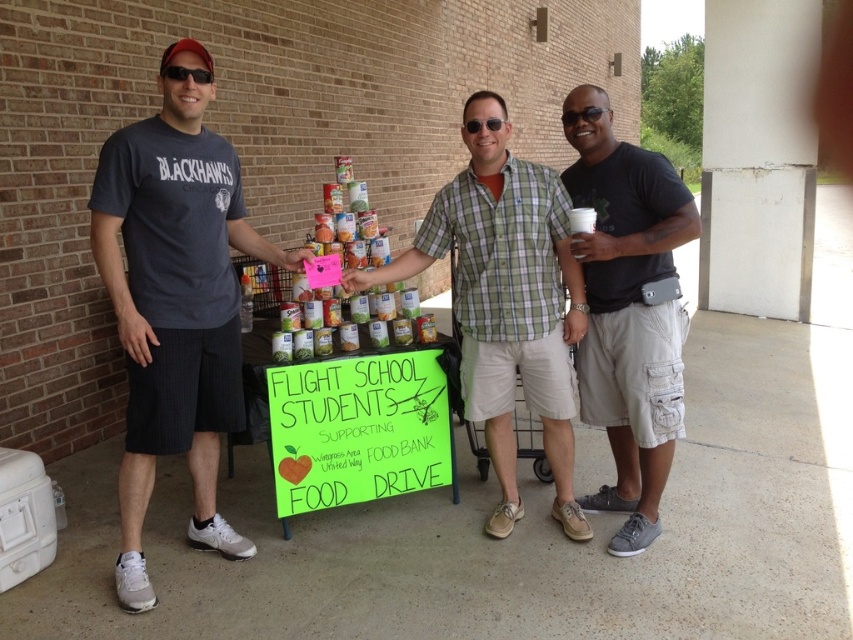
What is the color of the shirt worn by the person standing at the point (175, 301)?

The person at point (175, 301) is wearing a dark gray t shirt.

You are a participant in the food drive and need to place a new canned good on the cart. The cart has two points marked as reference points. The first point is at coordinates point(238, 420) and the second point is at point(656, 424). Which point is closer to you when standing in front of the cart?

The point at coordinates point(238, 420) is closer to you because it is further to the viewer than point(656, 424).